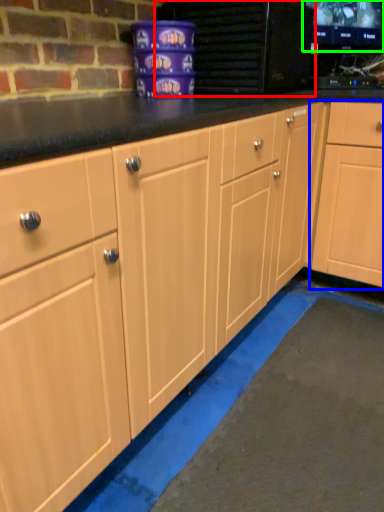
Question: Which object is positioned farthest from appliance (highlighted by a red box)? Select from cabinetry (highlighted by a blue box) and computer monitor (highlighted by a green box).

Choices:
 (A) cabinetry
 (B) computer monitor

Answer: (B)